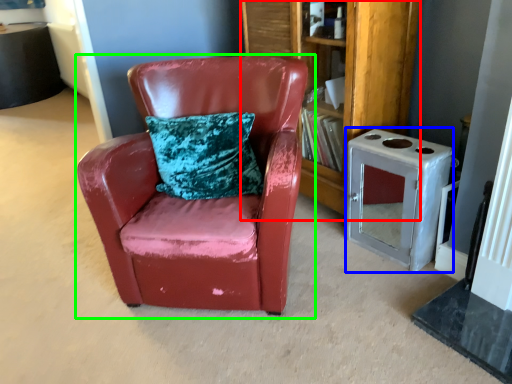
Question: Which object is the farthest from bookshelf (highlighted by a red box)? Choose among these: appliance (highlighted by a blue box) or chair (highlighted by a green box).

Choices:
 (A) appliance
 (B) chair

Answer: (B)